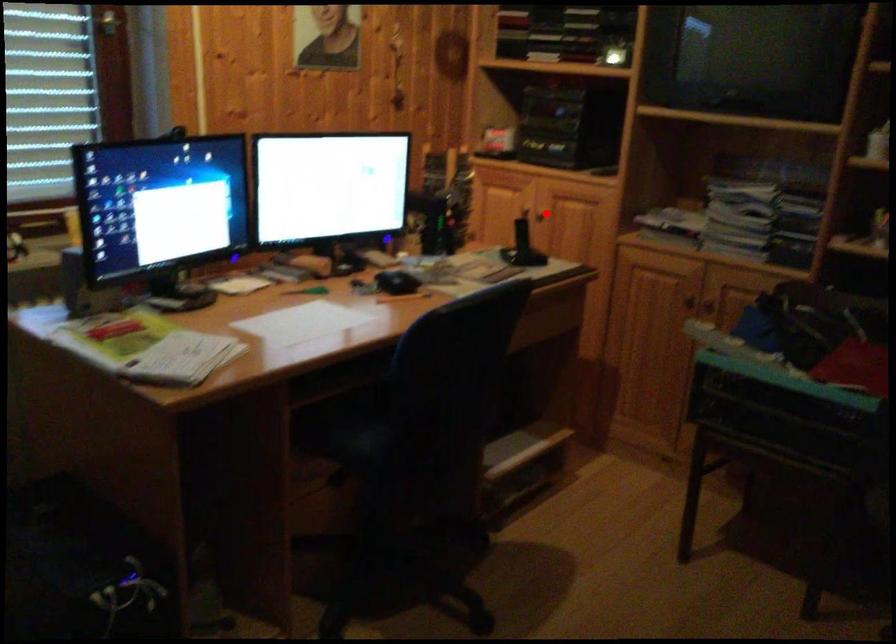
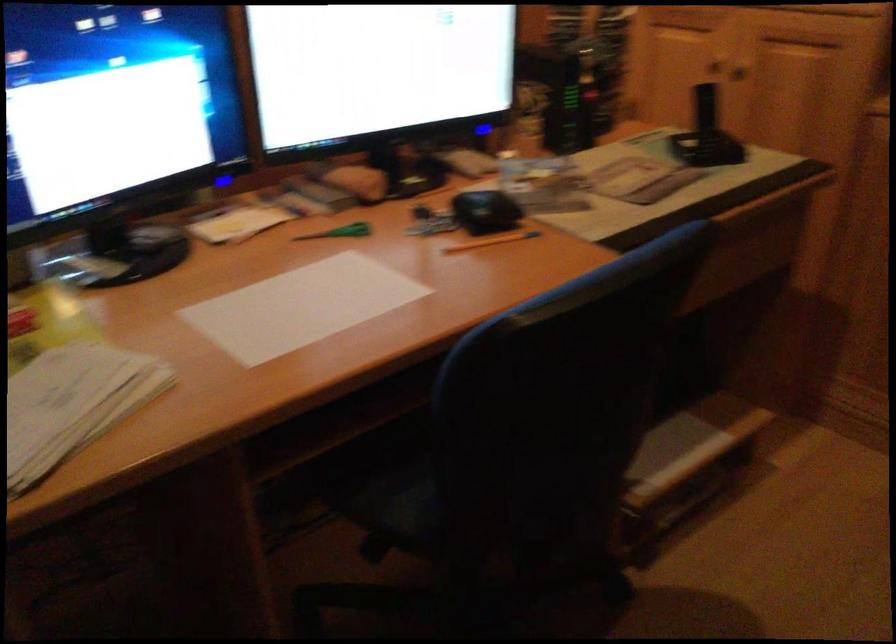
In the second image, find the point that corresponds to the highlighted location in the first image.

(734, 76)